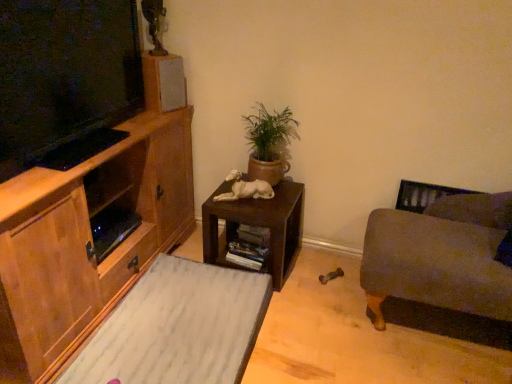
Find the location of a particular element. free space in front of matte gray speaker at upper center is located at coordinates (145, 116).